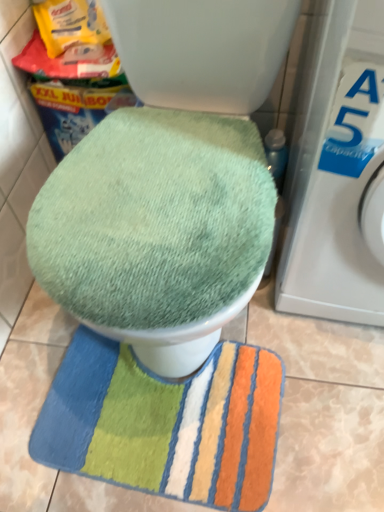
Question: Can you confirm if green fabric toilet seat at center is thinner than green plush rug at lower center?

Choices:
 (A) no
 (B) yes

Answer: (A)

Question: Considering the relative sizes of green fabric toilet seat at center and green plush rug at lower center in the image provided, is green fabric toilet seat at center shorter than green plush rug at lower center?

Choices:
 (A) no
 (B) yes

Answer: (A)

Question: Can you confirm if green fabric toilet seat at center is bigger than green plush rug at lower center?

Choices:
 (A) no
 (B) yes

Answer: (B)

Question: From a real-world perspective, is green fabric toilet seat at center beneath green plush rug at lower center?

Choices:
 (A) no
 (B) yes

Answer: (A)

Question: Can you confirm if green fabric toilet seat at center is positioned to the left of green plush rug at lower center?

Choices:
 (A) no
 (B) yes

Answer: (A)

Question: From the image's perspective, is green fabric toilet seat at center over green plush rug at lower center?

Choices:
 (A) yes
 (B) no

Answer: (A)

Question: Is green plush rug at lower center oriented away from white plastic washing machine at right?

Choices:
 (A) no
 (B) yes

Answer: (A)

Question: Does green plush rug at lower center have a greater height compared to white plastic washing machine at right?

Choices:
 (A) yes
 (B) no

Answer: (B)

Question: Can you confirm if green plush rug at lower center is bigger than white plastic washing machine at right?

Choices:
 (A) no
 (B) yes

Answer: (A)

Question: Are green plush rug at lower center and white plastic washing machine at right located far from each other?

Choices:
 (A) no
 (B) yes

Answer: (A)

Question: Is green plush rug at lower center located outside white plastic washing machine at right?

Choices:
 (A) yes
 (B) no

Answer: (A)

Question: Is green plush rug at lower center to the left of white plastic washing machine at right from the viewer's perspective?

Choices:
 (A) yes
 (B) no

Answer: (A)

Question: Is white plastic washing machine at right facing away from green plush rug at lower center?

Choices:
 (A) no
 (B) yes

Answer: (A)